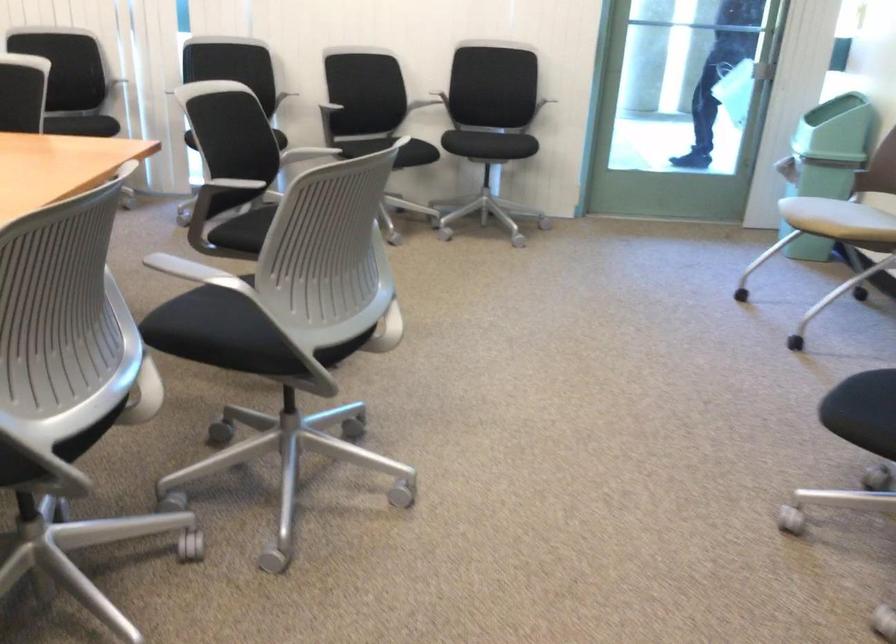
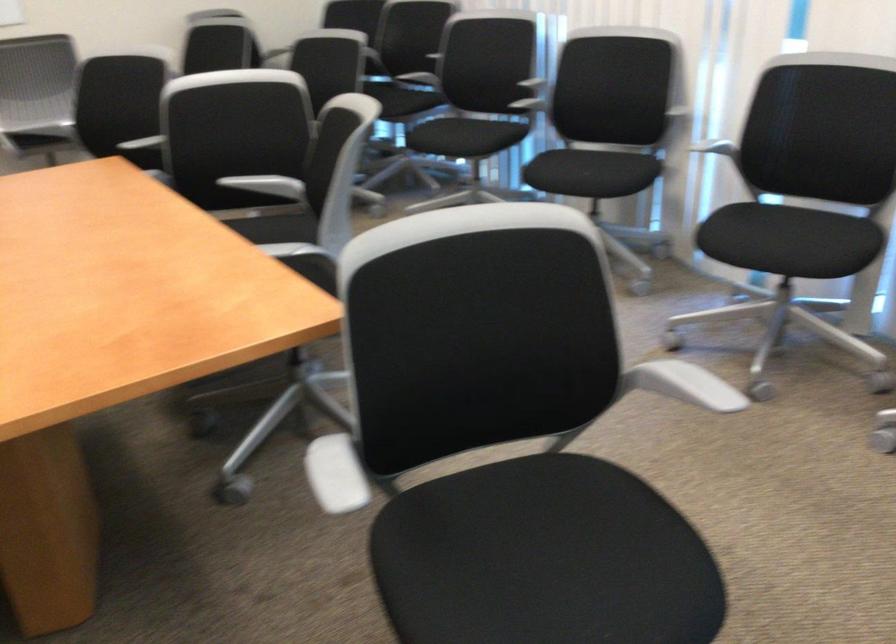
Locate, in the second image, the point that corresponds to [194,80] in the first image.

(718, 149)